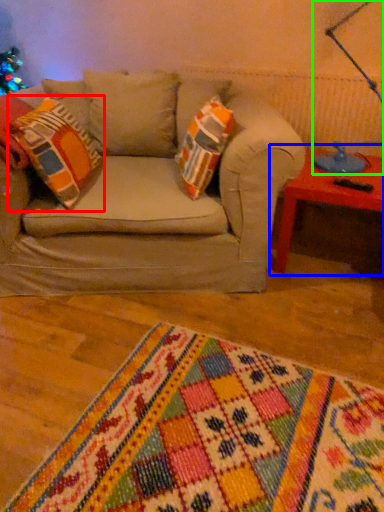
Question: Which object is positioned closest to throw pillow (highlighted by a red box)? Select from table (highlighted by a blue box) and table lamp (highlighted by a green box).

Choices:
 (A) table
 (B) table lamp

Answer: (A)